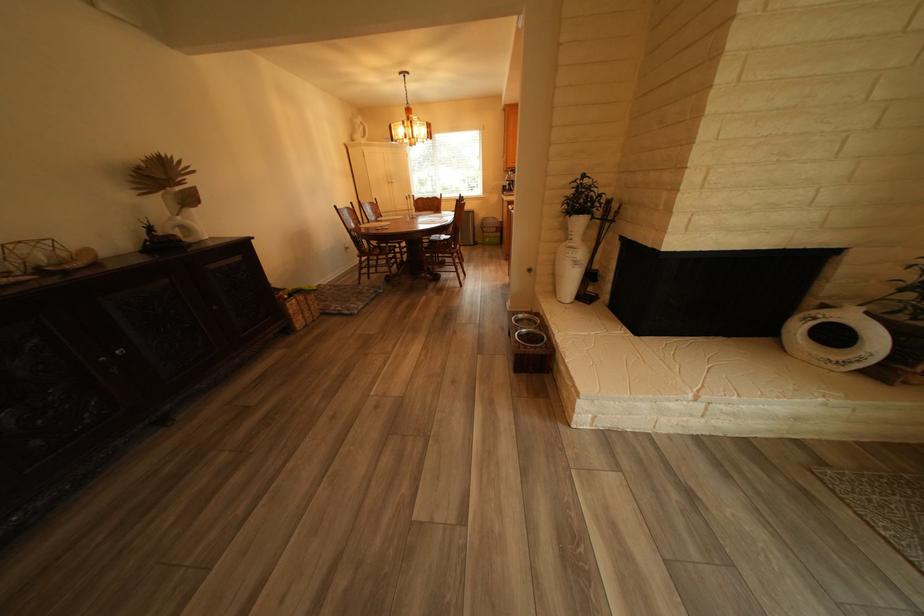
The location [570,259] corresponds to which object?

It corresponds to the white vase in the image.